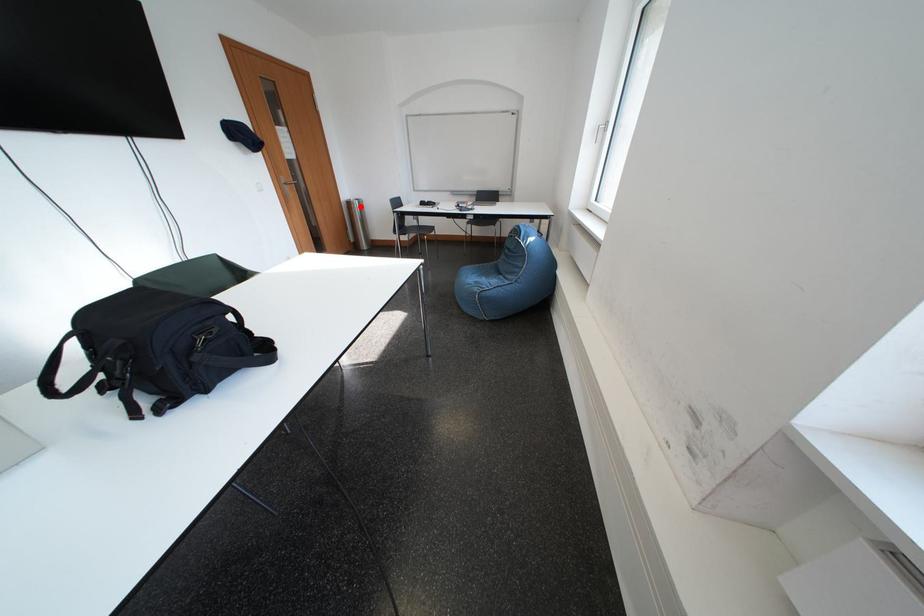
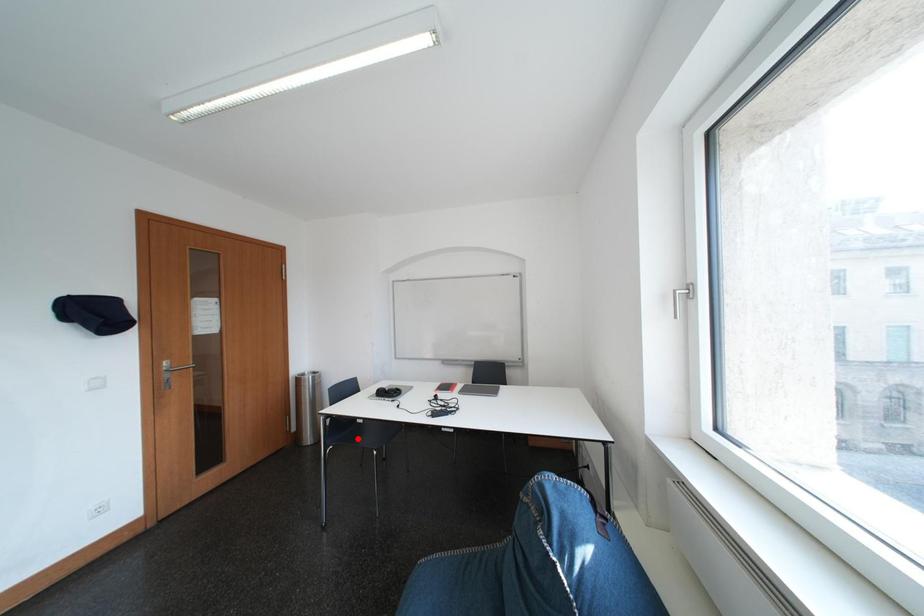
I am providing you with two images of the same scene from different viewpoints. A red point is marked on the first image and another point is marked on the second image. Do the highlighted points in image1 and image2 indicate the same real-world spot?

No